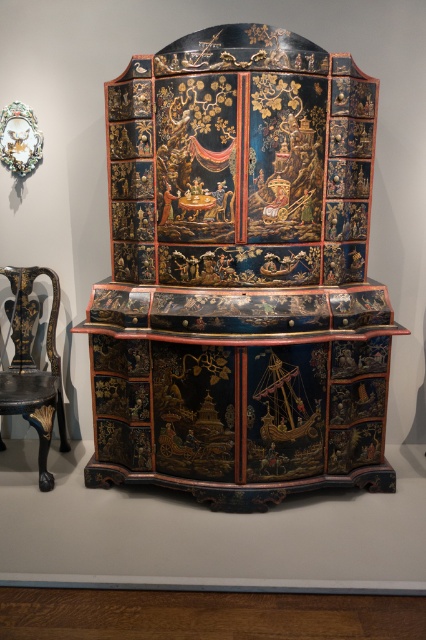
Question: Does glossy lacquered cabinet at center have a smaller size compared to glossy black wood chair at left?

Choices:
 (A) yes
 (B) no

Answer: (B)

Question: Is glossy lacquered cabinet at center smaller than glossy black wood chair at left?

Choices:
 (A) no
 (B) yes

Answer: (A)

Question: Does glossy lacquered cabinet at center have a larger size compared to glossy black wood chair at left?

Choices:
 (A) no
 (B) yes

Answer: (B)

Question: Which point appears closest to the camera in this image?

Choices:
 (A) (25, 416)
 (B) (342, 148)

Answer: (B)

Question: Which object is closer to the camera taking this photo?

Choices:
 (A) glossy lacquered cabinet at center
 (B) glossy black wood chair at left

Answer: (A)